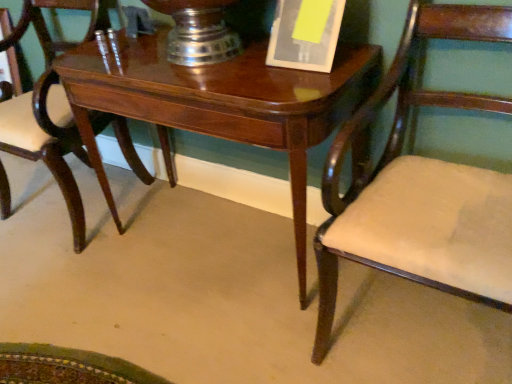
Where is `blank area beneath matte wood chair at right, arranged as the 2th chair when viewed from the left (from a real-world perspective)`? blank area beneath matte wood chair at right, arranged as the 2th chair when viewed from the left (from a real-world perspective) is located at coordinates (411, 328).